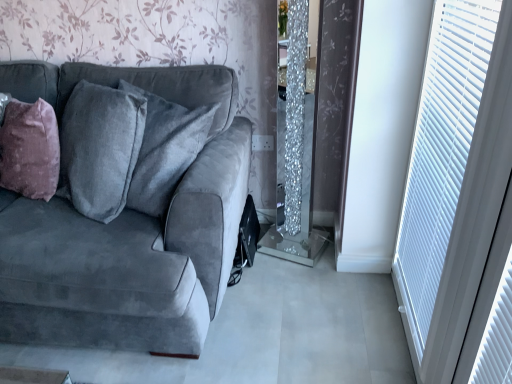
Question: From the image's perspective, is mauve velvet throw pillow at left located above or below white plastic blinds at right?

Choices:
 (A) below
 (B) above

Answer: (B)

Question: From a real-world perspective, is mauve velvet throw pillow at left physically located above or below white plastic blinds at right?

Choices:
 (A) above
 (B) below

Answer: (B)

Question: Which of these objects is positioned farthest from the velvet gray couch at left?

Choices:
 (A) mauve velvet throw pillow at left
 (B) white plastic blinds at right

Answer: (B)

Question: Which object is positioned farthest from the velvet gray couch at left?

Choices:
 (A) white plastic blinds at right
 (B) mauve velvet throw pillow at left

Answer: (A)